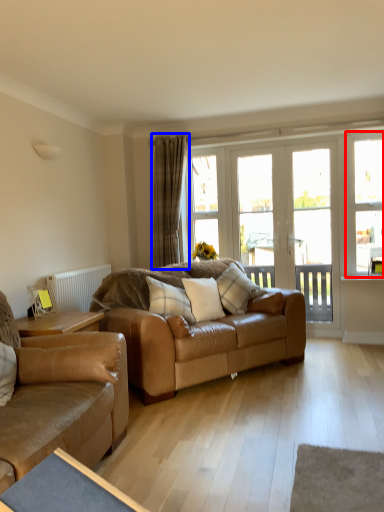
Question: Which point is closer to the camera, window (highlighted by a red box) or curtain (highlighted by a blue box)?

Choices:
 (A) window
 (B) curtain

Answer: (A)